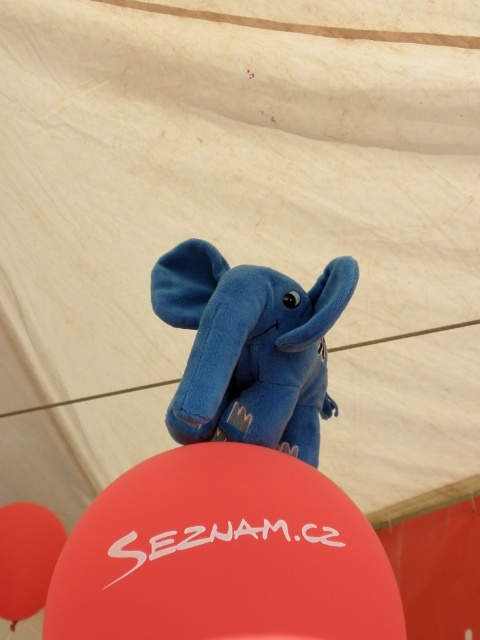
This screenshot has width=480, height=640. Identify the location of blue plush elephant at center. (250, 348).

Is point (308, 400) farther from viewer compared to point (13, 627)?

That is False.

Locate an element on the screen. blue plush elephant at center is located at coordinates (250, 348).

Is rubber balloon at center bigger than smooth red balloon at lower left?

Yes.

Can you confirm if rubber balloon at center is thinner than smooth red balloon at lower left?

No, rubber balloon at center is not thinner than smooth red balloon at lower left.

Who is more distant from viewer, (160, 618) or (23, 522)?

The point (23, 522) is behind.

Where is `rubber balloon at center`? rubber balloon at center is located at coordinates (223, 556).

Can you confirm if rubber balloon at center is smaller than blue plush elephant at center?

Yes.

Is point (235, 468) farther from viewer compared to point (184, 296)?

No, it is not.

Where is `rubber balloon at center`? This screenshot has height=640, width=480. rubber balloon at center is located at coordinates (223, 556).